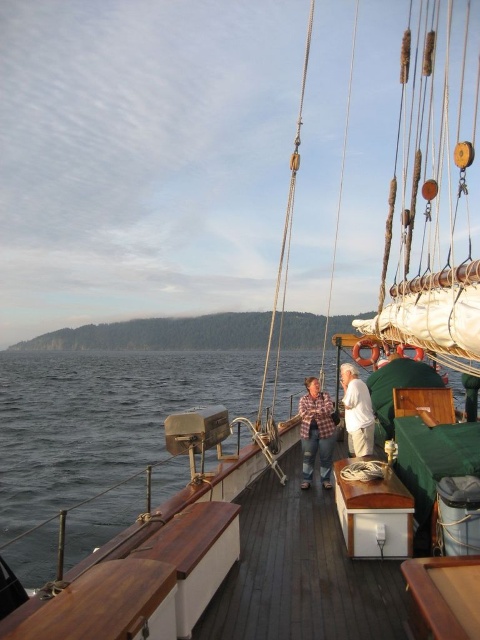
Does dark blue water at lower left appear on the right side of plaid shirt at center?

In fact, dark blue water at lower left is to the left of plaid shirt at center.

Is dark blue water at lower left shorter than plaid shirt at center?

In fact, dark blue water at lower left may be taller than plaid shirt at center.

The image size is (480, 640). Describe the element at coordinates (99, 429) in the screenshot. I see `dark blue water at lower left` at that location.

This screenshot has height=640, width=480. What are the coordinates of `dark blue water at lower left` in the screenshot? It's located at (99, 429).

Measure the distance between point (302, 449) and camera.

Point (302, 449) is 9.87 meters from camera.

Between plaid shirt at center and plaid fabric shirt at center, which one is positioned higher?

Positioned higher is plaid shirt at center.

Where is `plaid shirt at center`? This screenshot has width=480, height=640. plaid shirt at center is located at coordinates pos(315,433).

Looking at this image, is plaid fabric shirt at center to the right of white cotton shirt at center from the viewer's perspective?

No, plaid fabric shirt at center is not to the right of white cotton shirt at center.

The image size is (480, 640). What do you see at coordinates (315, 432) in the screenshot? I see `plaid fabric shirt at center` at bounding box center [315, 432].

Where is `plaid fabric shirt at center`? The width and height of the screenshot is (480, 640). plaid fabric shirt at center is located at coordinates (315, 432).

Identify the location of plaid fabric shirt at center. The image size is (480, 640). (315, 432).